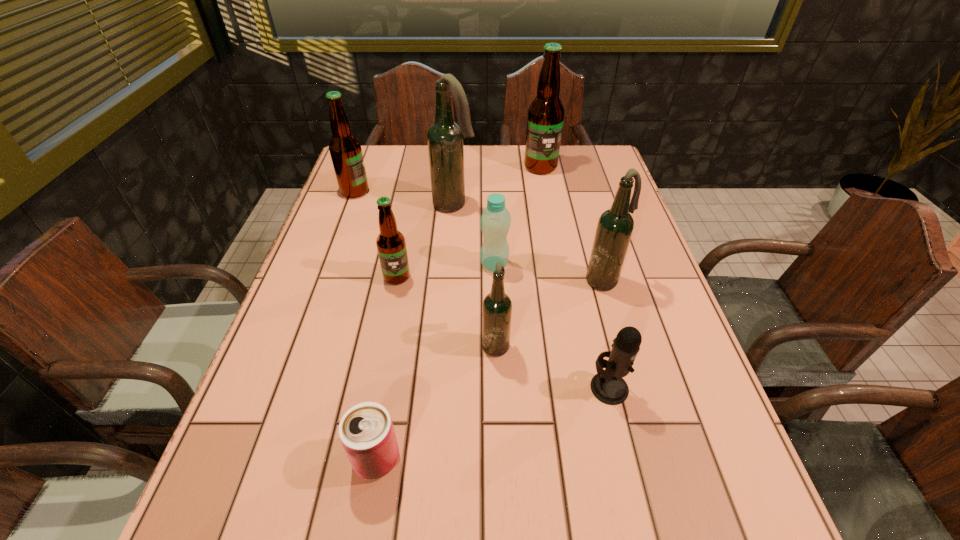
Locate an element on the screen. The width and height of the screenshot is (960, 540). vacant region located on the label of the leftmost object is located at coordinates (487, 192).

At what (x,y) coordinates should I click in order to perform the action: click on free space located on the label of the second brown beer bottle from right to left. Please return your answer as a coordinate pair (x, y). Looking at the image, I should click on [387, 329].

I want to click on free space located 0.250m on the left of the smallest dark beer bottle, so click(x=364, y=343).

I want to click on free region located 0.300m on the back of the bottle, so click(492, 191).

Where is `vacant space situated 0.140m on the front of the microphone`? The width and height of the screenshot is (960, 540). vacant space situated 0.140m on the front of the microphone is located at coordinates (632, 482).

This screenshot has height=540, width=960. I want to click on vacant point located 0.180m on the left of the nearest object, so click(x=248, y=459).

This screenshot has height=540, width=960. I want to click on object located in the far edge section of the desktop, so click(x=545, y=119).

Image resolution: width=960 pixels, height=540 pixels. What are the coordinates of `object present at the left edge` in the screenshot? It's located at [x=345, y=149].

I want to click on beer bottle positioned at the right edge, so click(x=615, y=226).

The height and width of the screenshot is (540, 960). Identify the location of microphone at the right edge. (608, 386).